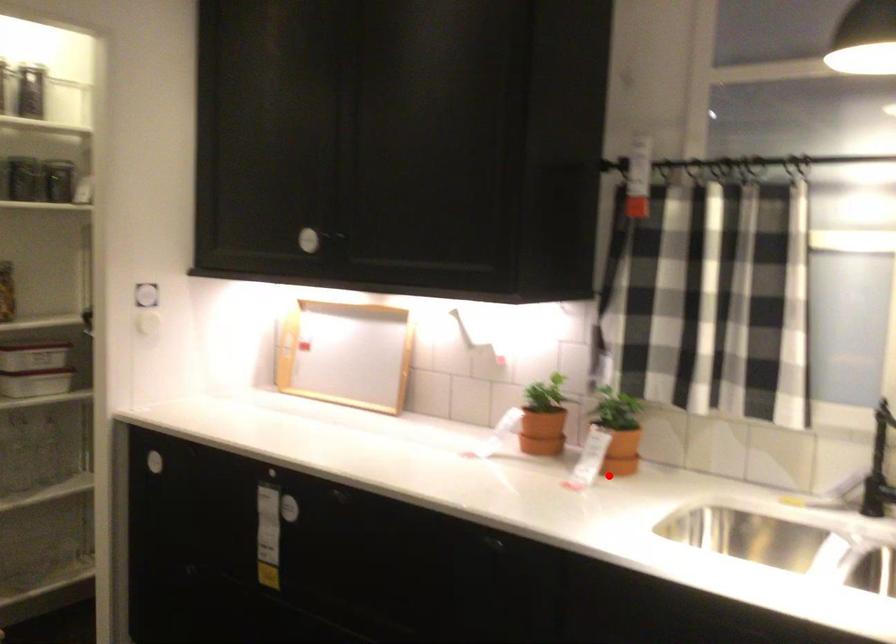
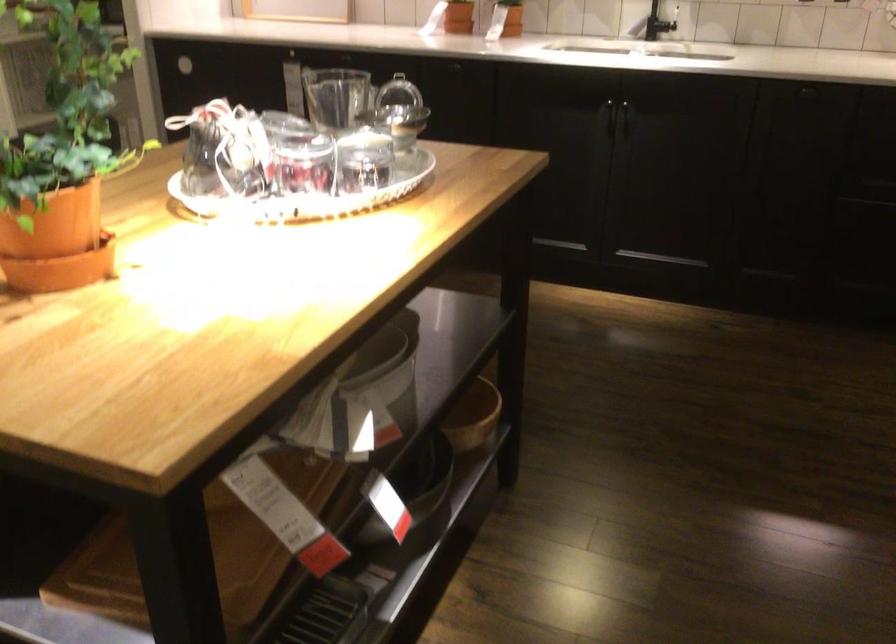
The point at the highlighted location is marked in the first image. Where is the corresponding point in the second image?

(504, 31)